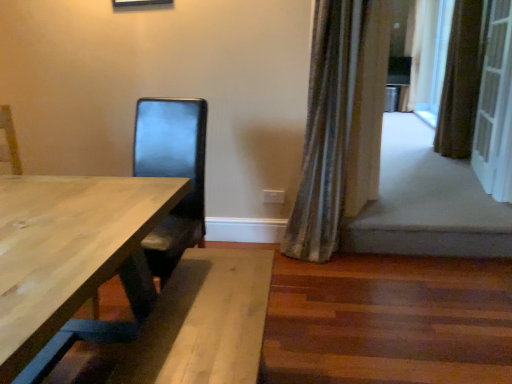
The height and width of the screenshot is (384, 512). In order to click on vacant area situated below silky green curtain at right, the third curtain viewed from the right (from a real-world perspective) in this screenshot , I will do `click(324, 257)`.